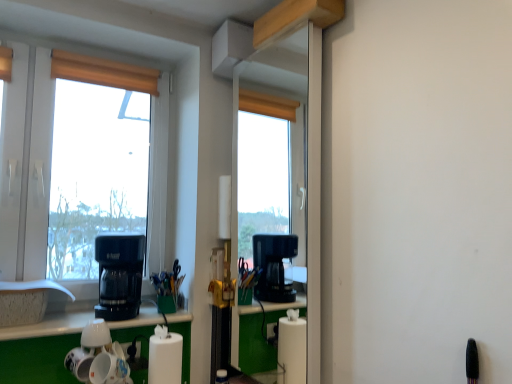
This screenshot has width=512, height=384. Identify the location of white glossy mugs at lower left. (98, 357).

This screenshot has height=384, width=512. What are the coordinates of `wooden blind at upper left` in the screenshot? It's located at (103, 72).

I want to click on white glossy mugs at lower left, so point(98,357).

From a real-world perspective, is white glossy mugs at lower left below white plastic window at left?

Indeed, from a real-world perspective, white glossy mugs at lower left is positioned beneath white plastic window at left.

Is white glossy mugs at lower left situated inside white plastic window at left or outside?

white glossy mugs at lower left is not enclosed by white plastic window at left.

Is the position of white glossy mugs at lower left less distant than that of white plastic window at left?

That is True.

From the picture: Considering the relative sizes of white glossy mugs at lower left and white plastic window at left in the image provided, is white glossy mugs at lower left wider than white plastic window at left?

Yes.

From the image's perspective, which one is positioned lower, black plastic coffee maker at left or wooden blind at upper left?

black plastic coffee maker at left, from the image's perspective.

Which of these two, black plastic coffee maker at left or wooden blind at upper left, is bigger?

With larger size is black plastic coffee maker at left.

Locate an element on the screen. This screenshot has height=384, width=512. curtain above the black plastic coffee maker at left (from the image's perspective) is located at coordinates (103, 72).

Consider the image. Is black plastic coffee maker at left looking in the opposite direction of wooden blind at upper left?

No, wooden blind at upper left is not at the back of black plastic coffee maker at left.

Looking at this image, considering the sizes of objects white glossy mugs at lower left and white glossy counter top at lower center in the image provided, who is smaller, white glossy mugs at lower left or white glossy counter top at lower center?

white glossy mugs at lower left is smaller.

Which point is more forward, (127, 372) or (178, 313)?

The point (127, 372) is in front.

From the image's perspective, is white glossy mugs at lower left located beneath white glossy counter top at lower center?

Yes, from the image's perspective, white glossy mugs at lower left is below white glossy counter top at lower center.

From a real-world perspective, is black plastic coffee maker at left physically located above or below white plastic window at left?

In terms of real-world spatial position, black plastic coffee maker at left is below white plastic window at left.

Consider the image. Are black plastic coffee maker at left and white plastic window at left beside each other?

No.

Is black plastic coffee maker at left wider or thinner than white plastic window at left?

In the image, black plastic coffee maker at left appears to be wider than white plastic window at left.

Considering the positions of objects black plastic coffee maker at left and white plastic window at left in the image provided, who is more to the right, black plastic coffee maker at left or white plastic window at left?

black plastic coffee maker at left is more to the right.

Considering the relative sizes of black plastic coffee maker at left and white glossy mugs at lower left in the image provided, is black plastic coffee maker at left smaller than white glossy mugs at lower left?

Incorrect, black plastic coffee maker at left is not smaller in size than white glossy mugs at lower left.

From a real-world perspective, is black plastic coffee maker at left above or below white glossy mugs at lower left?

black plastic coffee maker at left is above white glossy mugs at lower left.

Which object is positioned more to the right, black plastic coffee maker at left or white glossy mugs at lower left?

From the viewer's perspective, white glossy mugs at lower left appears more on the right side.

Which is more to the right, white glossy counter top at lower center or wooden blind at upper left?

white glossy counter top at lower center is more to the right.

Is white glossy counter top at lower center oriented towards wooden blind at upper left?

No, white glossy counter top at lower center is not facing towards wooden blind at upper left.

Which is further, (77, 316) or (152, 93)?

The point (152, 93) is farther from the camera.

Relative to wooden blind at upper left, is white glossy counter top at lower center in front or behind?

In the image, white glossy counter top at lower center appears in front of wooden blind at upper left.

What's the angular difference between white glossy counter top at lower center and white glossy mugs at lower left's facing directions?

The angle between the facing direction of white glossy counter top at lower center and the facing direction of white glossy mugs at lower left is 5.06 degrees.

Does white glossy counter top at lower center appear on the left side of white glossy mugs at lower left?

Yes, white glossy counter top at lower center is to the left of white glossy mugs at lower left.

Do you think white glossy counter top at lower center is within white glossy mugs at lower left, or outside of it?

white glossy counter top at lower center cannot be found inside white glossy mugs at lower left.

From the image's perspective, would you say white glossy counter top at lower center is shown under white glossy mugs at lower left?

No, from the image's perspective, white glossy counter top at lower center is not beneath white glossy mugs at lower left.

This screenshot has width=512, height=384. What are the coordinates of `appliance that is under the white plastic window at left (from a real-world perspective)` in the screenshot? It's located at (98, 357).

Locate an element on the screen. curtain that is above the black plastic coffee maker at left (from a real-world perspective) is located at coordinates (103, 72).

When comparing their distances from wooden blind at upper left, does white glossy counter top at lower center or white glossy mugs at lower left seem further?

white glossy mugs at lower left lies further to wooden blind at upper left than the other object.

Estimate the real-world distances between objects in this image. Which object is closer to black plastic coffee maker at left, wooden blind at upper left or white glossy counter top at lower center?

Based on the image, white glossy counter top at lower center appears to be nearer to black plastic coffee maker at left.

Considering their positions, is white plastic window at left positioned further to white glossy counter top at lower center than white glossy mugs at lower left?

white plastic window at left lies further to white glossy counter top at lower center than the other object.

When comparing their distances from black plastic coffee maker at left, does white plastic window at left or wooden blind at upper left seem closer?

The object closer to black plastic coffee maker at left is white plastic window at left.

Looking at the image, which one is located closer to white plastic window at left, white glossy counter top at lower center or white glossy mugs at lower left?

Among the two, white glossy counter top at lower center is located nearer to white plastic window at left.

Consider the image. Based on their spatial positions, is white plastic window at left or black plastic coffee maker at left closer to wooden blind at upper left?

white plastic window at left lies closer to wooden blind at upper left than the other object.

Looking at the image, which one is located closer to black plastic coffee maker at left, white glossy mugs at lower left or wooden blind at upper left?

white glossy mugs at lower left lies closer to black plastic coffee maker at left than the other object.

From the picture: Estimate the real-world distances between objects in this image. Which object is further from white glossy mugs at lower left, black plastic coffee maker at left or white plastic window at left?

Among the two, white plastic window at left is located further to white glossy mugs at lower left.

Where is `counter top that lies between white plastic window at left and white glossy mugs at lower left from top to bottom`? The image size is (512, 384). counter top that lies between white plastic window at left and white glossy mugs at lower left from top to bottom is located at coordinates pyautogui.click(x=49, y=326).

Where is `kitchen appliance that lies between white plastic window at left and white glossy counter top at lower center from top to bottom`? This screenshot has width=512, height=384. kitchen appliance that lies between white plastic window at left and white glossy counter top at lower center from top to bottom is located at coordinates (119, 275).

The width and height of the screenshot is (512, 384). Identify the location of kitchen appliance between wooden blind at upper left and white glossy counter top at lower center in the up-down direction. (119, 275).

Where is `window between wooden blind at upper left and white glossy mugs at lower left in the up-down direction`? The width and height of the screenshot is (512, 384). window between wooden blind at upper left and white glossy mugs at lower left in the up-down direction is located at coordinates tap(158, 178).